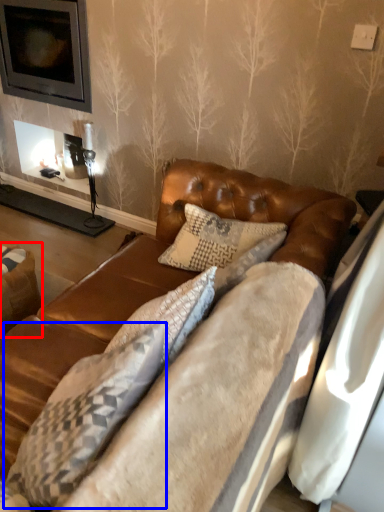
Question: Among these objects, which one is nearest to the camera, swivel chair (highlighted by a red box) or pillow (highlighted by a blue box)?

Choices:
 (A) swivel chair
 (B) pillow

Answer: (B)